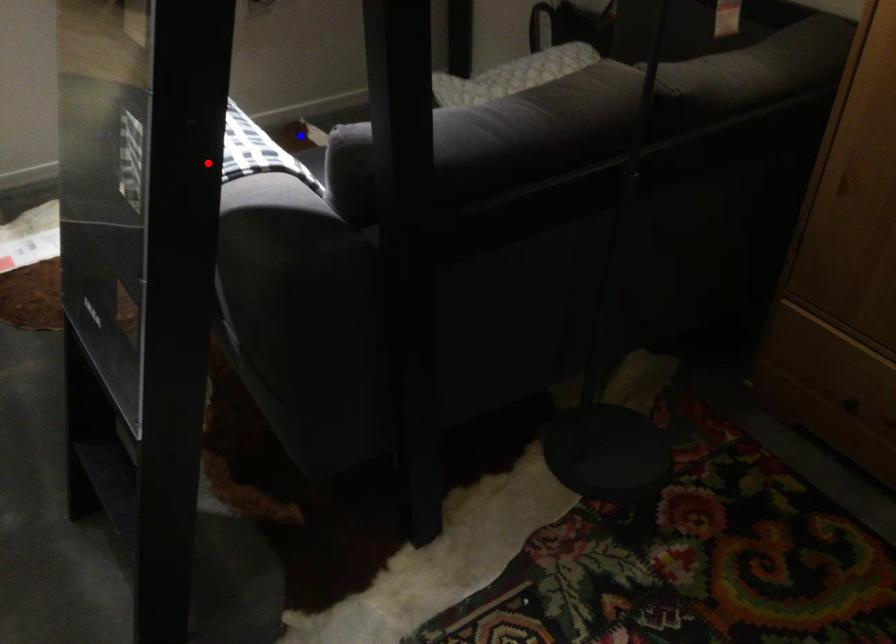
Question: Two points are marked on the image. Which point is closer to the camera?

Choices:
 (A) Blue point is closer.
 (B) Red point is closer.

Answer: (B)